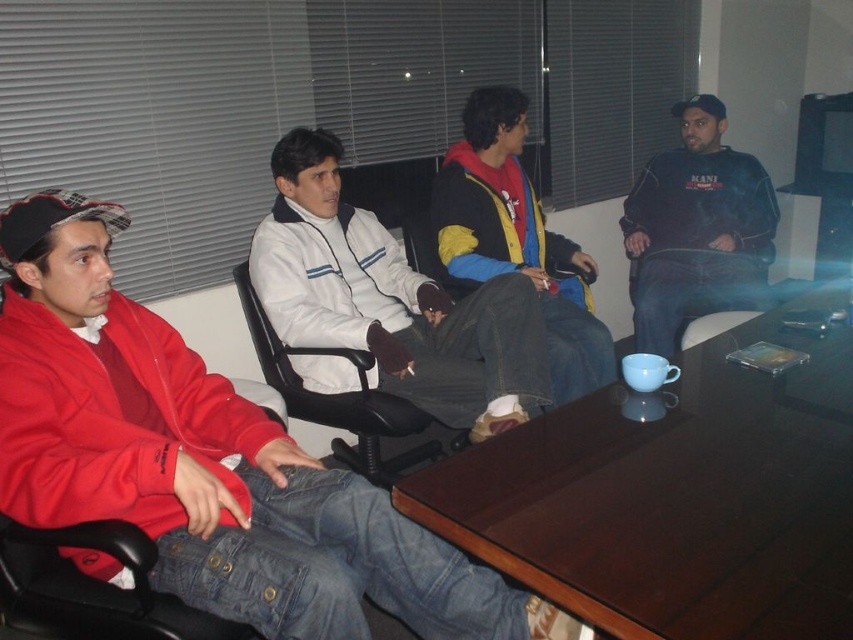
Is matte red jacket at left to the left of white fleece jacket at center from the viewer's perspective?

Yes, matte red jacket at left is to the left of white fleece jacket at center.

What do you see at coordinates (202, 461) in the screenshot?
I see `matte red jacket at left` at bounding box center [202, 461].

In order to click on matte red jacket at left in this screenshot , I will do `click(202, 461)`.

The width and height of the screenshot is (853, 640). Identify the location of matte red jacket at left. (202, 461).

Is matte red jacket at left wider than black leather swivel chair at center?

Yes.

Between point (160, 356) and point (426, 426), which one is positioned behind?

The point (426, 426) is behind.

This screenshot has width=853, height=640. What are the coordinates of `matte red jacket at left` in the screenshot? It's located at (202, 461).

You are a GUI agent. You are given a task and a screenshot of the screen. Output one action in this format:
    pyautogui.click(x=<x>, y=<y>)
    Task: Click on the brown wooden table at center
    The width and height of the screenshot is (853, 640).
    Given the screenshot: What is the action you would take?
    pyautogui.click(x=676, y=496)

Can you confirm if brown wooden table at center is shorter than multicolored fleece jacket at center?

Yes.

I want to click on brown wooden table at center, so click(x=676, y=496).

This screenshot has height=640, width=853. What are the coordinates of `brown wooden table at center` in the screenshot? It's located at (676, 496).